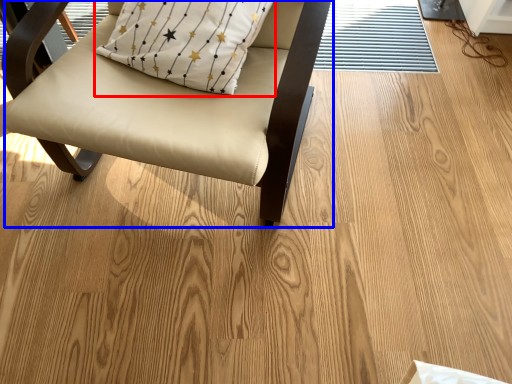
Question: Which of the following is the closest to the observer, pillow (highlighted by a red box) or chair (highlighted by a blue box)?

Choices:
 (A) pillow
 (B) chair

Answer: (B)